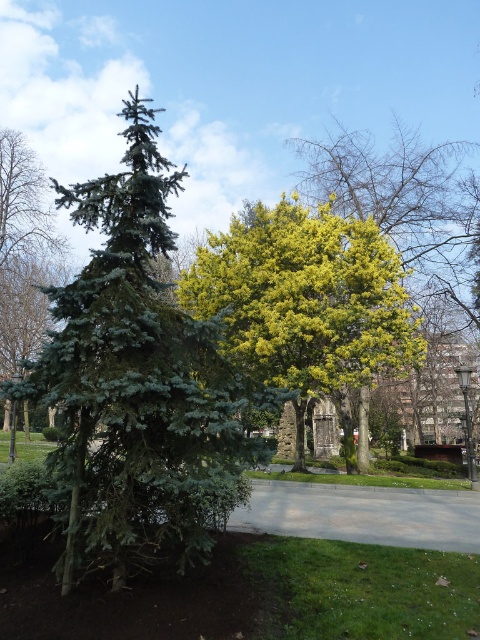
Question: Does yellow-green foliage at center appear over green needle-like tree at left?

Choices:
 (A) yes
 (B) no

Answer: (B)

Question: Which object appears farthest from the camera in this image?

Choices:
 (A) green needle-like tree at left
 (B) green needle-like at left
 (C) yellow-green leafy tree at upper center
 (D) yellow-green foliage at center

Answer: (C)

Question: Is green needle-like at left positioned in front of yellow-green leafy tree at upper center?

Choices:
 (A) yes
 (B) no

Answer: (A)

Question: Which object is closer to the camera taking this photo?

Choices:
 (A) green needle-like at left
 (B) yellow-green foliage at center

Answer: (B)

Question: Considering the relative positions of green needle-like at left and yellow-green foliage at center in the image provided, where is green needle-like at left located with respect to yellow-green foliage at center?

Choices:
 (A) below
 (B) above

Answer: (A)

Question: Which object is positioned farthest from the yellow-green leafy tree at upper center?

Choices:
 (A) yellow-green foliage at center
 (B) green needle-like tree at left
 (C) green needle-like at left

Answer: (C)